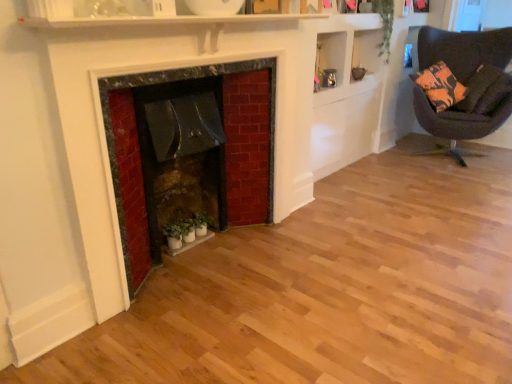
What do you see at coordinates (188, 228) in the screenshot? The image size is (512, 384). I see `green matte plant at lower center, which appears as the second plant when viewed from the right` at bounding box center [188, 228].

What are the coordinates of `rustic stone fireplace at center` in the screenshot? It's located at (x=169, y=82).

Describe the element at coordinates (169, 82) in the screenshot. I see `rustic stone fireplace at center` at that location.

At what (x,y) coordinates should I click in order to perform the action: click on orange-patterned fabric pillow at upper right. Please return your answer as a coordinate pair (x, y). The image size is (512, 384). Looking at the image, I should click on (480, 90).

This screenshot has height=384, width=512. What are the coordinates of `dark brown fabric chair at right` in the screenshot? It's located at (464, 50).

Is point (149, 266) closer to viewer compared to point (194, 230)?

Yes, it is.

Can you confirm if rustic stone fireplace at center is thinner than green matte plant at lower center, the second plant when ordered from back to front?

No.

This screenshot has height=384, width=512. What are the coordinates of `fireplace located above the green matte plant at lower center, the 1th plant when ordered from front to back (from a real-world perspective)` in the screenshot? It's located at (169, 82).

Considering the sizes of objects rustic stone fireplace at center and green matte plant at lower center, which appears as the second plant when viewed from the right, in the image provided, who is bigger, rustic stone fireplace at center or green matte plant at lower center, which appears as the second plant when viewed from the right,?

rustic stone fireplace at center is bigger.

In the image, is rustic stone fireplace at center positioned in front of or behind green leafy plant at upper right, which is counted as the first plant, starting from the top?

Clearly, rustic stone fireplace at center is in front of green leafy plant at upper right, which is counted as the first plant, starting from the top.

Where is `plant that appears above the rustic stone fireplace at center (from a real-world perspective)`? plant that appears above the rustic stone fireplace at center (from a real-world perspective) is located at coordinates (385, 24).

Looking at their sizes, would you say rustic stone fireplace at center is wider or thinner than green leafy plant at upper right, which is the 2th plant from left to right?

In the image, rustic stone fireplace at center appears to be wider than green leafy plant at upper right, which is the 2th plant from left to right.

Considering the relative positions of dark brown fabric chair at right and orange-patterned fabric pillow at upper right in the image provided, is dark brown fabric chair at right to the left or to the right of orange-patterned fabric pillow at upper right?

Clearly, dark brown fabric chair at right is on the left of orange-patterned fabric pillow at upper right in the image.

Is dark brown fabric chair at right bigger than orange-patterned fabric pillow at upper right?

Yes.

Is the surface of dark brown fabric chair at right in direct contact with orange-patterned fabric pillow at upper right?

There is a gap between dark brown fabric chair at right and orange-patterned fabric pillow at upper right.

What's the angular difference between dark brown fabric chair at right and orange-patterned fabric pillow at upper right's facing directions?

The angle between the facing direction of dark brown fabric chair at right and the facing direction of orange-patterned fabric pillow at upper right is 31.7 degrees.

Is dark brown fabric chair at right positioned far away from rustic stone fireplace at center?

Yes, dark brown fabric chair at right and rustic stone fireplace at center are located far from each other.

Could rustic stone fireplace at center be considered to be inside dark brown fabric chair at right?

No, rustic stone fireplace at center is located outside of dark brown fabric chair at right.

How different are the orientations of dark brown fabric chair at right and rustic stone fireplace at center in degrees?

They differ by 73.8 degrees in their facing directions.

Which of these two, dark brown fabric chair at right or rustic stone fireplace at center, is wider?

dark brown fabric chair at right.

Would you consider green matte plant at lower center, which appears as the second plant when viewed from the right, to be distant from rustic stone fireplace at center?

They are positioned close to each other.

Considering the positions of point (199, 233) and point (256, 69), is point (199, 233) closer or farther from the camera than point (256, 69)?

Point (199, 233).

Is green matte plant at lower center, the 2th plant viewed from the top, oriented away from rustic stone fireplace at center?

Correct, green matte plant at lower center, the 2th plant viewed from the top, is looking away from rustic stone fireplace at center.

Measure the distance between green matte plant at lower center, the 2th plant viewed from the top, and rustic stone fireplace at center.

61.34 centimeters.

Can you tell me how much orange-patterned fabric pillow at upper right and green matte plant at lower center, the 1th plant when ordered from front to back, differ in facing direction?

The angular difference between orange-patterned fabric pillow at upper right and green matte plant at lower center, the 1th plant when ordered from front to back, is 44.9 degrees.

Does orange-patterned fabric pillow at upper right have a larger size compared to green matte plant at lower center, the 2th plant viewed from the top?

Yes, orange-patterned fabric pillow at upper right is bigger than green matte plant at lower center, the 2th plant viewed from the top.

Considering the relative sizes of orange-patterned fabric pillow at upper right and green matte plant at lower center, the first plant in the left-to-right sequence, in the image provided, is orange-patterned fabric pillow at upper right shorter than green matte plant at lower center, the first plant in the left-to-right sequence,?

No, orange-patterned fabric pillow at upper right is not shorter than green matte plant at lower center, the first plant in the left-to-right sequence.

Can you confirm if orange-patterned fabric pillow at upper right is wider than green matte plant at lower center, the second plant when ordered from back to front?

Indeed, orange-patterned fabric pillow at upper right has a greater width compared to green matte plant at lower center, the second plant when ordered from back to front.

Which is correct: green leafy plant at upper right, which is counted as the first plant, starting from the top, is inside rustic stone fireplace at center, or outside of it?

green leafy plant at upper right, which is counted as the first plant, starting from the top, cannot be found inside rustic stone fireplace at center.

From the image's perspective, relative to rustic stone fireplace at center, is green leafy plant at upper right, the first plant from the back, above or below?

Based on their image positions, green leafy plant at upper right, the first plant from the back, is located above rustic stone fireplace at center.

The width and height of the screenshot is (512, 384). I want to click on fireplace below the green leafy plant at upper right, arranged as the 2th plant when viewed from the front (from the image's perspective), so click(169, 82).

Which object is further away from the camera, green leafy plant at upper right, arranged as the 2th plant when viewed from the front, or rustic stone fireplace at center?

green leafy plant at upper right, arranged as the 2th plant when viewed from the front, is further away from the camera.

Identify the location of fireplace above the green matte plant at lower center, the 2th plant viewed from the top (from the image's perspective). The image size is (512, 384). (169, 82).

Image resolution: width=512 pixels, height=384 pixels. In order to click on plant above the rustic stone fireplace at center (from a real-world perspective) in this screenshot , I will do `click(385, 24)`.

Looking at the image, which one is located further to green matte plant at lower center, the first plant in the left-to-right sequence, orange-patterned fabric pillow at upper right or green leafy plant at upper right, which is counted as the first plant, starting from the top?

orange-patterned fabric pillow at upper right lies further to green matte plant at lower center, the first plant in the left-to-right sequence, than the other object.

Considering their positions, is green matte plant at lower center, the 2th plant viewed from the top, positioned closer to orange-patterned fabric pillow at upper right than dark brown fabric chair at right?

The object closer to orange-patterned fabric pillow at upper right is dark brown fabric chair at right.

From the image, which object appears to be nearer to rustic stone fireplace at center, dark brown fabric chair at right or green matte plant at lower center, the second plant when ordered from back to front?

The object closer to rustic stone fireplace at center is green matte plant at lower center, the second plant when ordered from back to front.

When comparing their distances from green leafy plant at upper right, which is the 2th plant from left to right, does orange-patterned fabric pillow at upper right or green matte plant at lower center, the second plant when ordered from back to front, seem closer?

orange-patterned fabric pillow at upper right.

When comparing their distances from green matte plant at lower center, the second plant when ordered from back to front, does dark brown fabric chair at right or rustic stone fireplace at center seem further?

dark brown fabric chair at right lies further to green matte plant at lower center, the second plant when ordered from back to front, than the other object.

Based on their spatial positions, is green leafy plant at upper right, the first plant from the back, or dark brown fabric chair at right closer to orange-patterned fabric pillow at upper right?

dark brown fabric chair at right is closer to orange-patterned fabric pillow at upper right.

Looking at the image, which one is located further to orange-patterned fabric pillow at upper right, rustic stone fireplace at center or dark brown fabric chair at right?

Based on the image, rustic stone fireplace at center appears to be further to orange-patterned fabric pillow at upper right.

Consider the image. Looking at the image, which one is located closer to green matte plant at lower center, the 2th plant viewed from the top, green leafy plant at upper right, which is the 1th plant from right to left, or orange-patterned fabric pillow at upper right?

Based on the image, green leafy plant at upper right, which is the 1th plant from right to left, appears to be nearer to green matte plant at lower center, the 2th plant viewed from the top.

Identify the location of plant situated between green matte plant at lower center, which appears as the second plant when viewed from the right, and orange-patterned fabric pillow at upper right from left to right. [385, 24].

The width and height of the screenshot is (512, 384). I want to click on chair between rustic stone fireplace at center and orange-patterned fabric pillow at upper right, so click(x=464, y=50).

In order to click on chair situated between green leafy plant at upper right, which is the 1th plant from right to left, and orange-patterned fabric pillow at upper right from left to right in this screenshot , I will do `click(464, 50)`.

Find the location of a particular element. plant between green matte plant at lower center, the 2th plant viewed from the top, and dark brown fabric chair at right, in the horizontal direction is located at coordinates (385, 24).